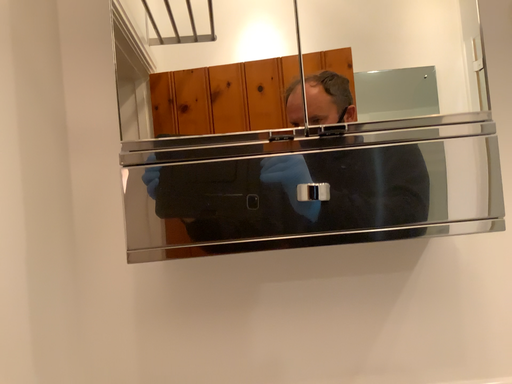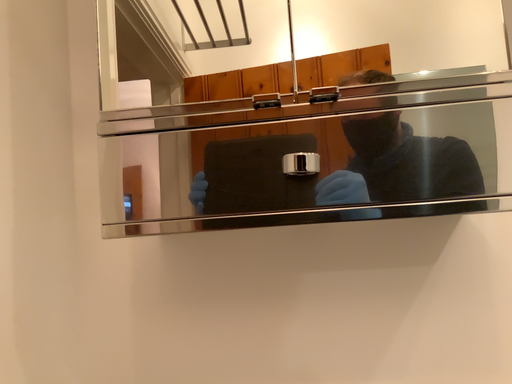
Question: Which way did the camera rotate in the video?

Choices:
 (A) rotated left
 (B) rotated right

Answer: (A)